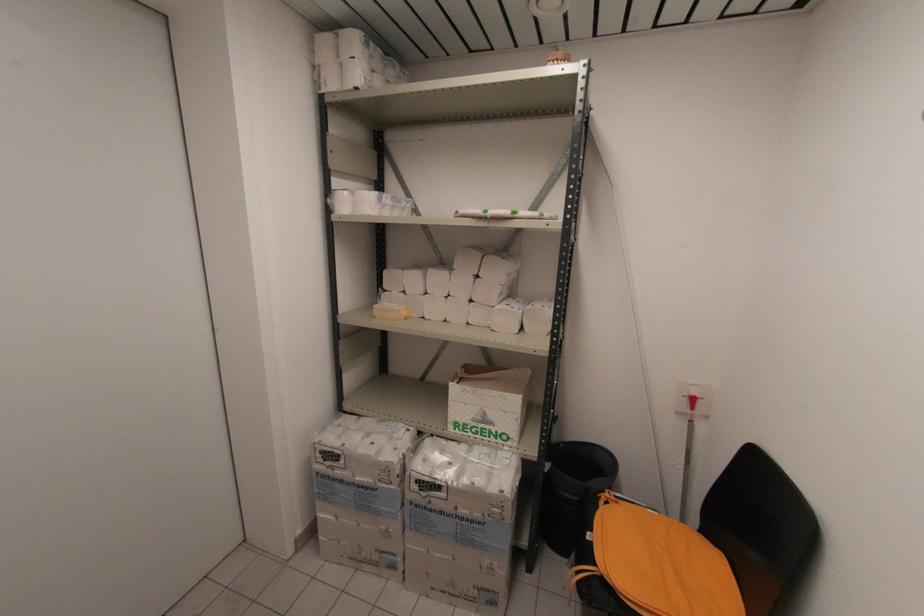
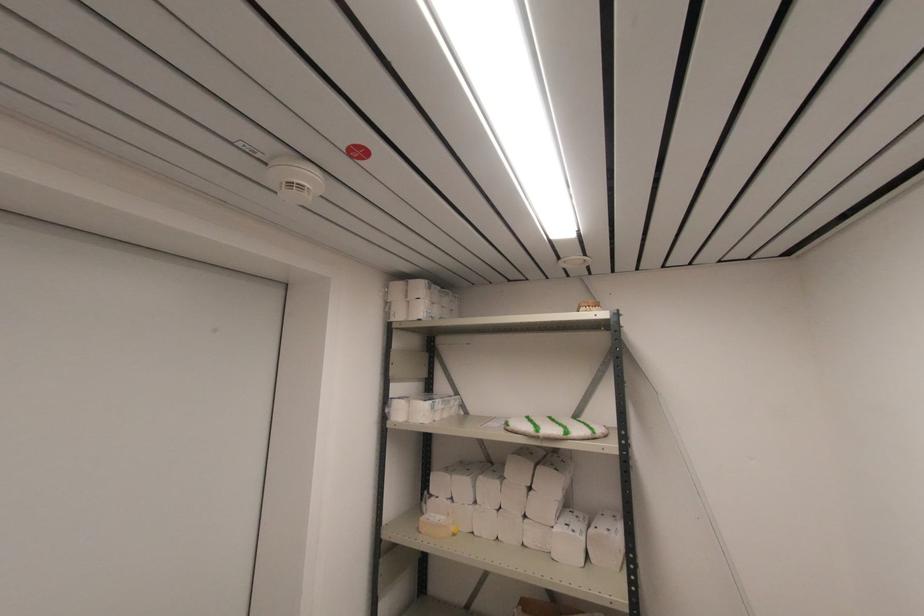
Locate, in the second image, the point that corresponds to (x=484, y=215) in the first image.

(537, 436)